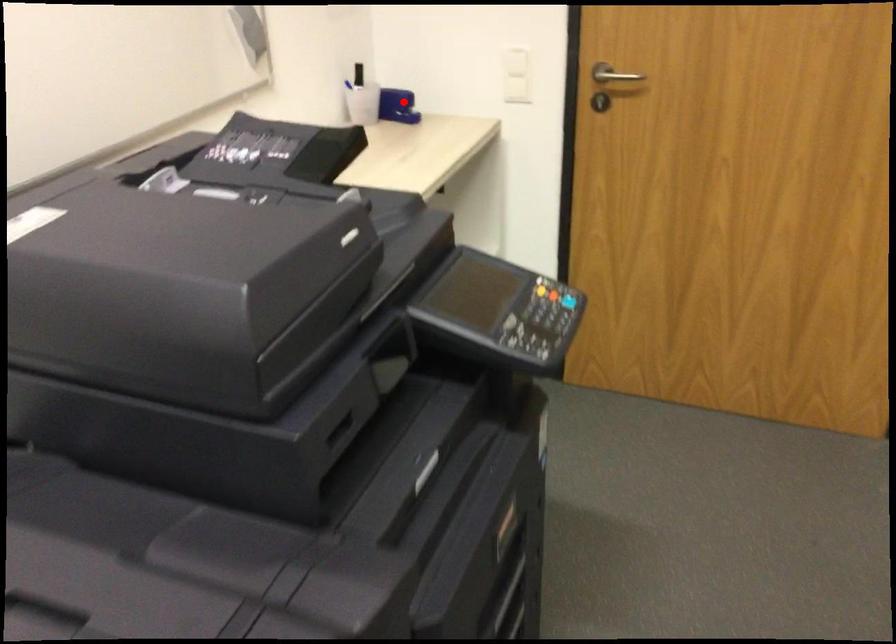
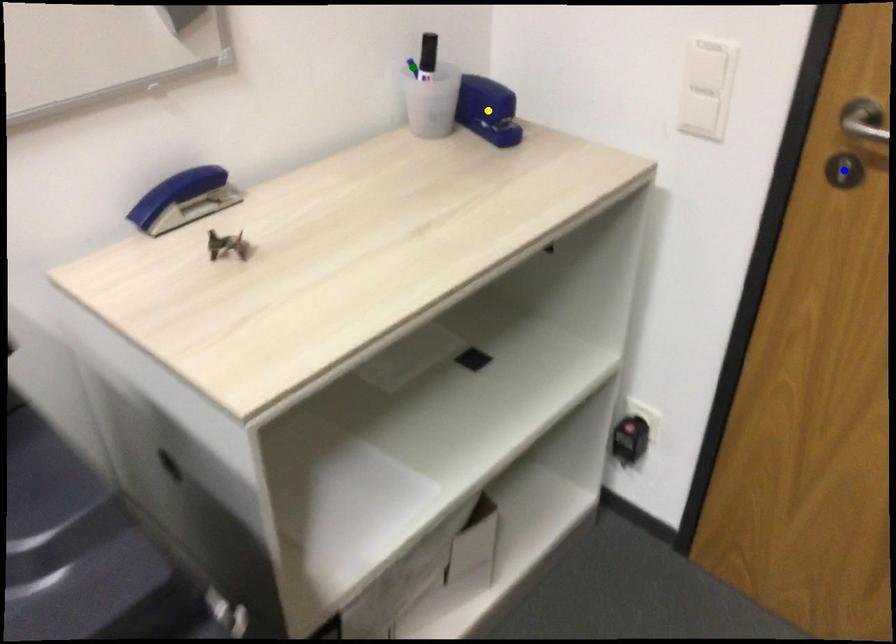
Question: I am providing you with two images of the same scene from different viewpoints. A red point is marked on the first image. You are given multiple points on the second image. In image 2, which mark is for the same physical point as the one in image 1?

Choices:
 (A) green point
 (B) blue point
 (C) yellow point

Answer: (C)